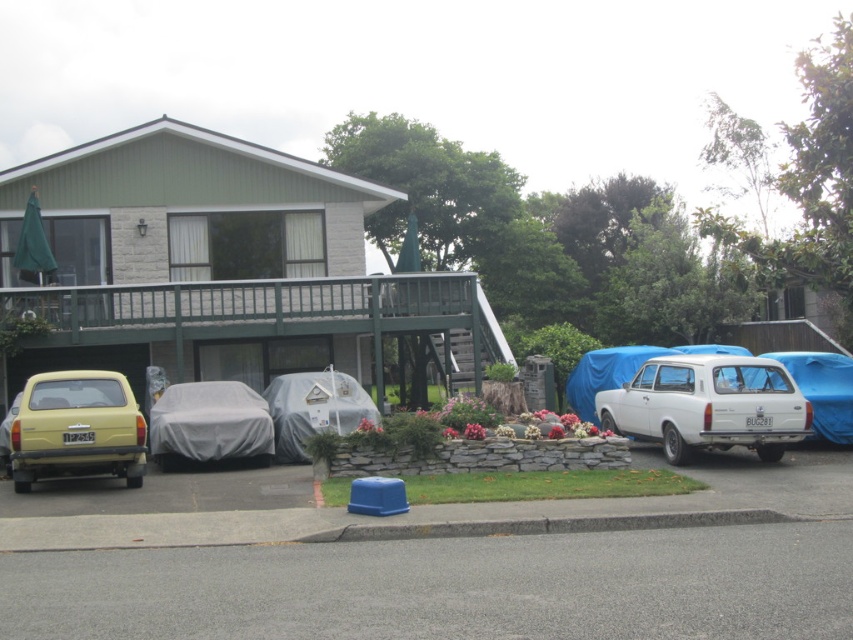
You are planning to park your car in the driveway next to the white matte station wagon at right and the matte yellow car at left. Based on their widths, which car should you consider moving first to ensure enough space for your vehicle?

The white matte station wagon at right might be wider than the matte yellow car at left, so you should consider moving the white matte station wagon at right first to ensure enough space for your vehicle.

In the scene shown: You are a delivery driver who needs to park your van between the white matte station wagon at right and the matte yellow car at left. The van is 6 meters long. Can you fit it in the space between them?

The distance between the white matte station wagon at right and the matte yellow car at left is 9.04 meters. Since the van is 6 meters long, there is enough space to park it between them.